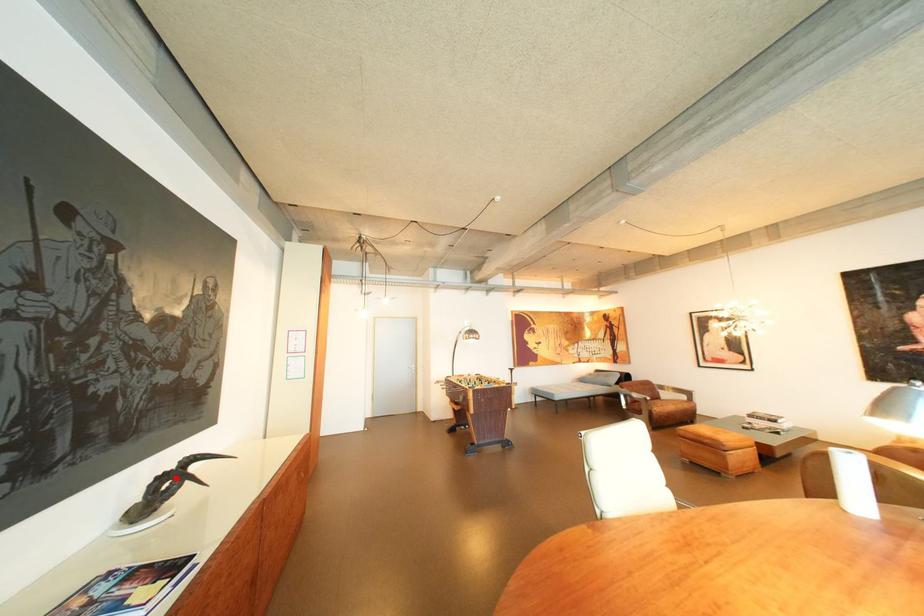
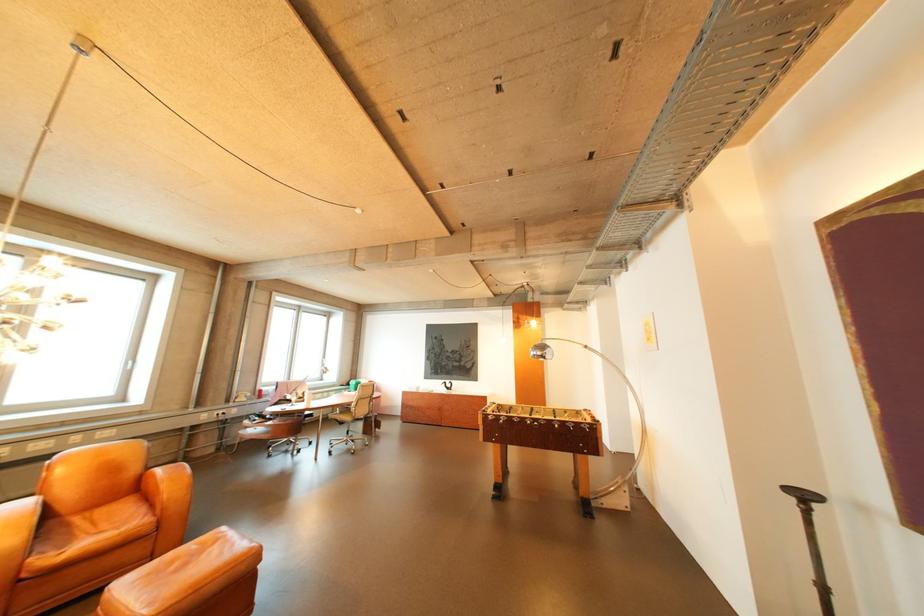
Question: I am providing you with two images of the same scene from different viewpoints. A red point is marked on the first image. Is the red point's position out of view in image 2?

Choices:
 (A) Yes
 (B) No

Answer: (A)